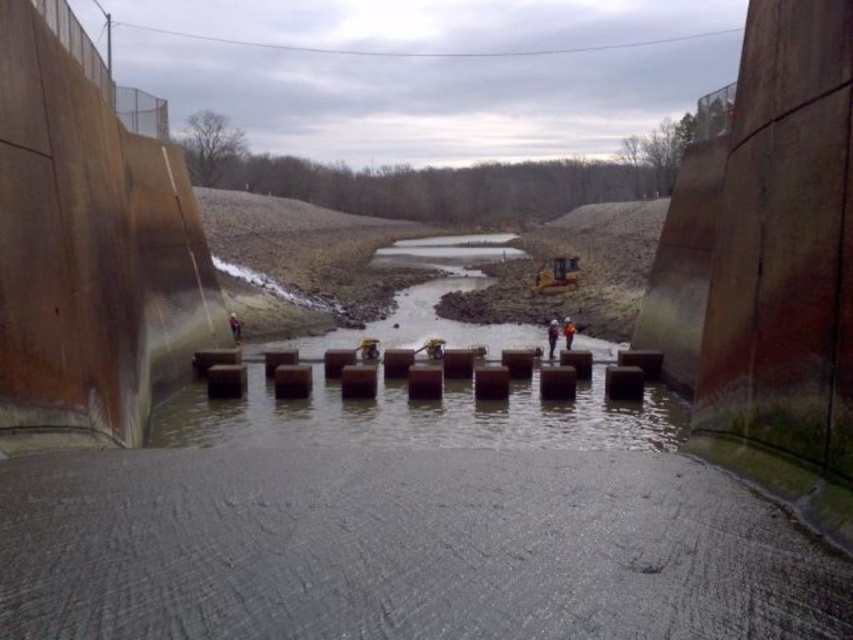
Question: Can you confirm if white hard hat at center is positioned below orange hard hat at center?

Choices:
 (A) yes
 (B) no

Answer: (A)

Question: Which point is closer to the camera?

Choices:
 (A) white hard hat at center
 (B) orange hard hat at center

Answer: (A)

Question: Which object appears farthest from the camera in this image?

Choices:
 (A) white hard hat at center
 (B) orange hard hat at center

Answer: (B)

Question: Does white hard hat at center have a larger size compared to orange hard hat at center?

Choices:
 (A) no
 (B) yes

Answer: (B)

Question: Which object appears farthest from the camera in this image?

Choices:
 (A) orange hard hat at center
 (B) white hard hat at center

Answer: (A)

Question: Does white hard hat at center have a larger size compared to orange hard hat at center?

Choices:
 (A) no
 (B) yes

Answer: (B)